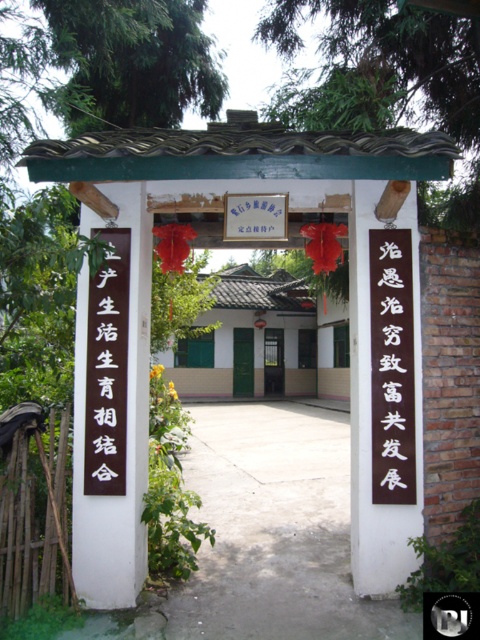
You are a visitor approaching the entrance gate. You notice two items at the center of the gate. What is positioned higher between the black paper at center and the metallic door at center?

The black paper at center is located above the metallic door at center, so it is positioned higher.

You are a visitor approaching the entrance gate. You notice a green leafy tree at upper center and a black paper at center. Which object is taller?

The green leafy tree at upper center is taller than the black paper at center.